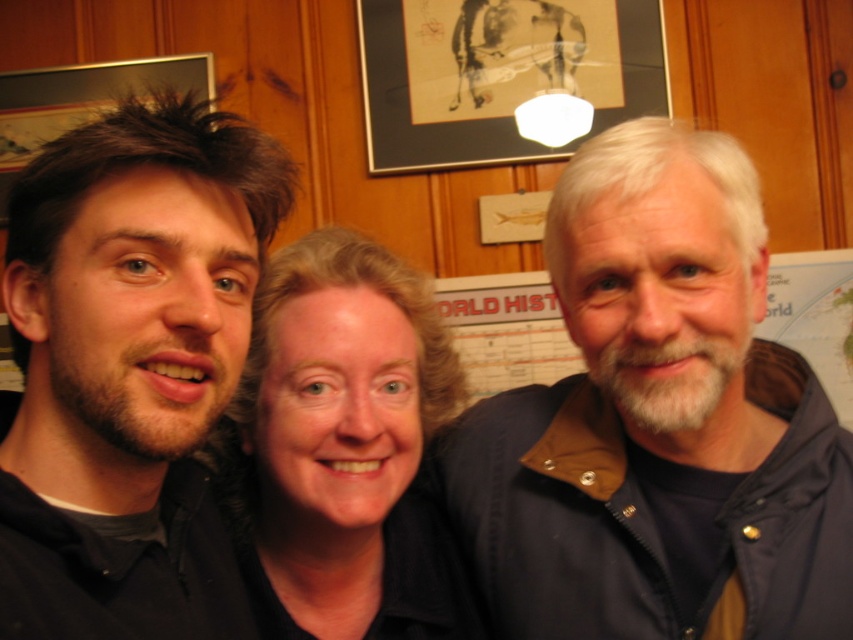
Can you confirm if dark blue jacket at right is smaller than black matte picture frame at upper center?

Incorrect, dark blue jacket at right is not smaller in size than black matte picture frame at upper center.

Which is more to the left, dark blue jacket at right or black matte picture frame at upper center?

dark blue jacket at right

Locate an element on the screen. dark blue jacket at right is located at coordinates (659, 422).

Does dark brown hair at left appear on the right side of black matte picture frame at upper center?

Incorrect, dark brown hair at left is not on the right side of black matte picture frame at upper center.

Is dark brown hair at left wider than black matte picture frame at upper center?

No.

Between point (186, 449) and point (526, 76), which one is positioned in front?

Point (186, 449) is in front.

The image size is (853, 640). I want to click on dark brown hair at left, so click(129, 365).

Does point (654, 40) lie in front of point (769, 296)?

No, (654, 40) is behind (769, 296).

Measure the distance from black matte picture frame at upper center to world map poster at center.

black matte picture frame at upper center is 23.51 inches from world map poster at center.

In order to click on black matte picture frame at upper center in this screenshot , I will do `click(498, 74)`.